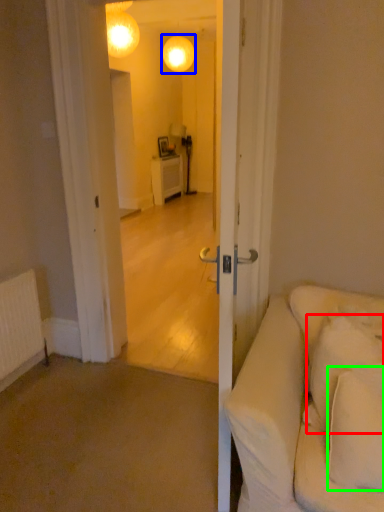
Question: Which object is the farthest from pillow (highlighted by a red box)? Choose among these: lamp (highlighted by a blue box) or pillow (highlighted by a green box).

Choices:
 (A) lamp
 (B) pillow

Answer: (A)